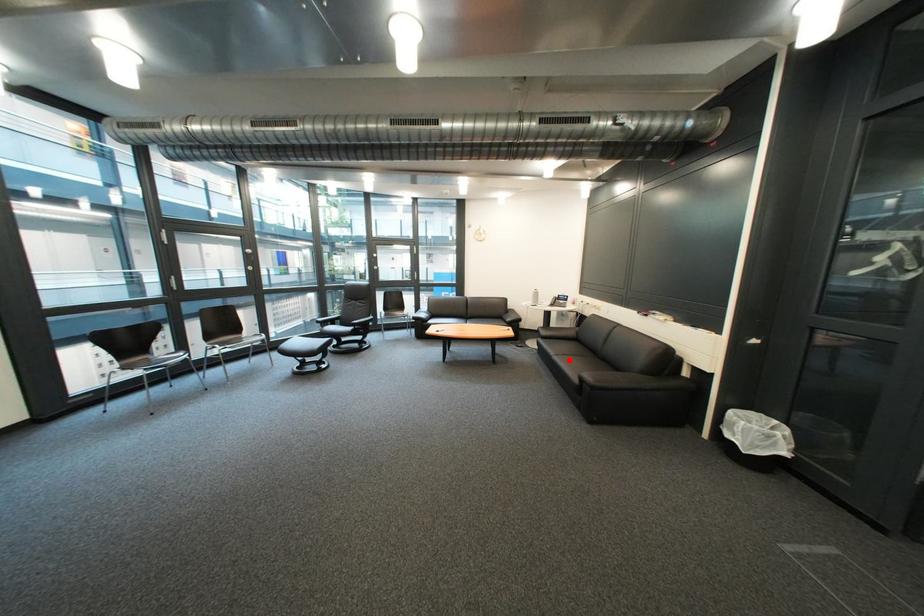
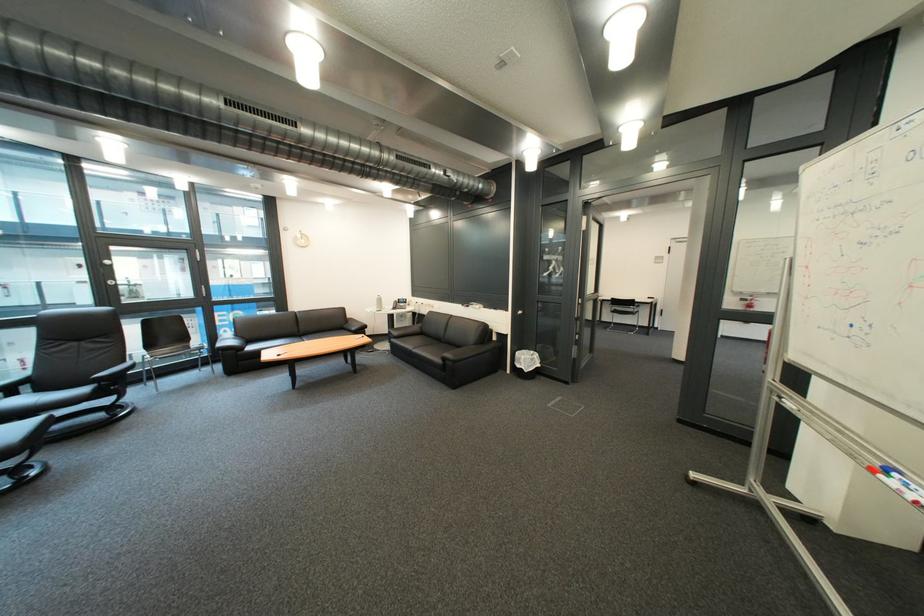
Question: A red point is marked in image1. In image2, is the corresponding 3D point closer to the camera or farther? Reply with the corresponding letter.

Choices:
 (A) The corresponding 3D point is closer.
 (B) The corresponding 3D point is farther.

Answer: (B)